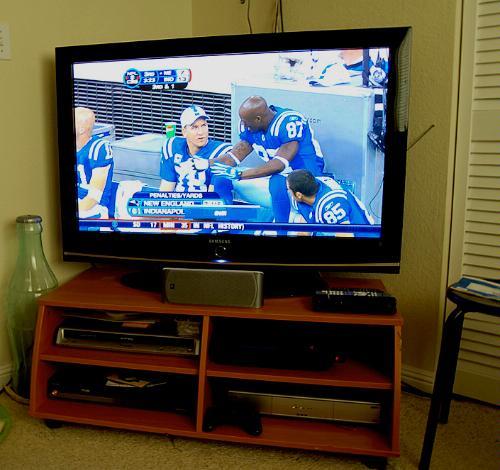
Image resolution: width=500 pixels, height=470 pixels. I want to click on samsung tv, so click(217, 240).